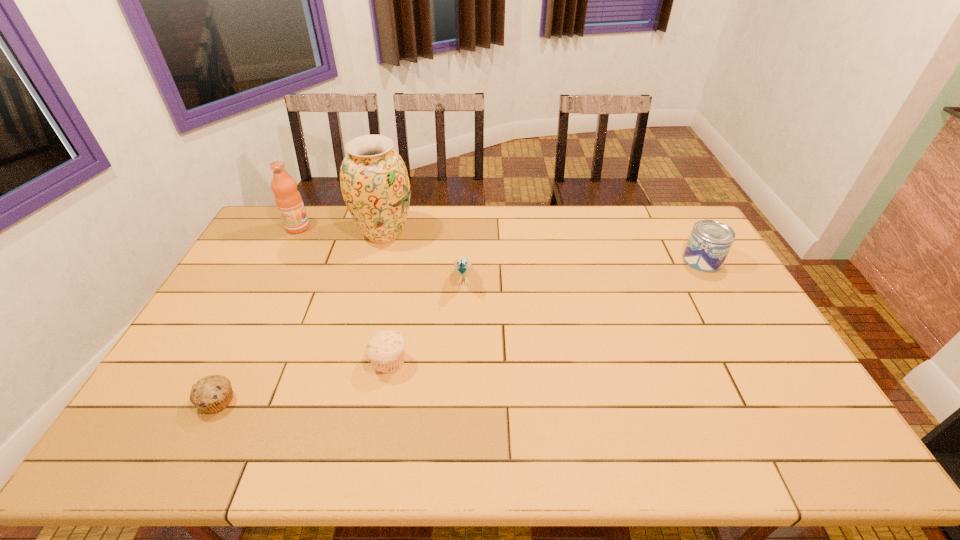
At what (x,y) coordinates should I click in order to perform the action: click on free space that satisfies the following two spatial constraints: 1. on the label side of the farther muffin; 2. on the left side of the fifth shortest object. Please return your answer as a coordinate pair (x, y). Image resolution: width=960 pixels, height=540 pixels. Looking at the image, I should click on (227, 363).

The image size is (960, 540). Find the location of `vacant point that satisfies the following two spatial constraints: 1. on the label side of the fruit juice; 2. on the back side of the vase`. vacant point that satisfies the following two spatial constraints: 1. on the label side of the fruit juice; 2. on the back side of the vase is located at coordinates (295, 234).

Identify the location of vacant region that satisfies the following two spatial constraints: 1. on the back side of the tallest object; 2. on the left side of the left muffin. The image size is (960, 540). (301, 234).